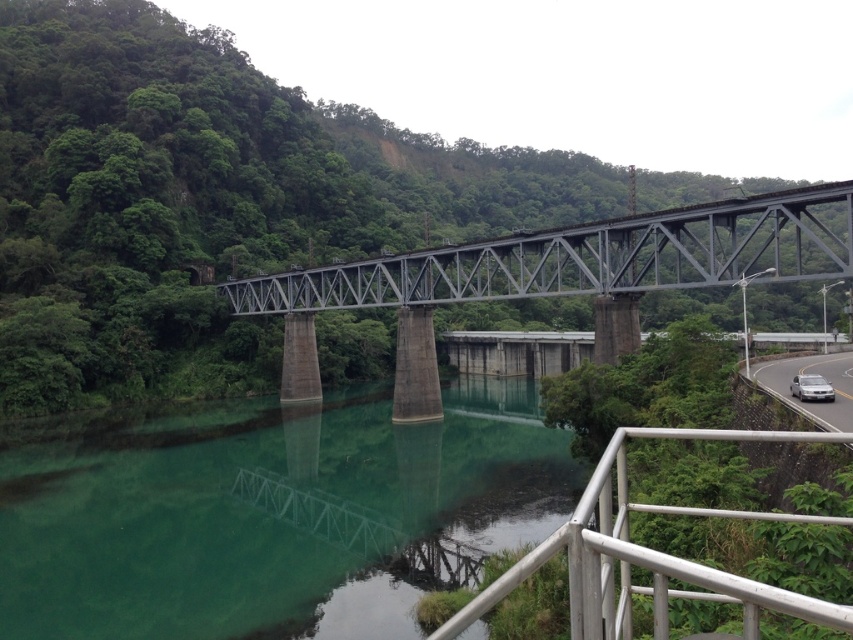
You are standing on the bridge and looking towards the road. Which object is nearer to you, the silver metallic railing at lower right or the white glossy car at right?

The silver metallic railing at lower right is closer to the viewer than the white glossy car at right.

You are standing at the origin point of the image. Which direction should you move to reach the green concrete river at center?

Since the green concrete river at center is located at coordinate point 0.808 on the x axis and 0.321 on the y axis, you should move towards the right and slightly upwards to reach it.

You are standing on the bridge and looking towards the road. There are two points marked on the bridge deck, namely point (380, 508) and point (851, 394). Which point is closer to your current position?

Point (380, 508) is further to the viewer than point (851, 394). Therefore, point (851, 394) is closer to your current position.